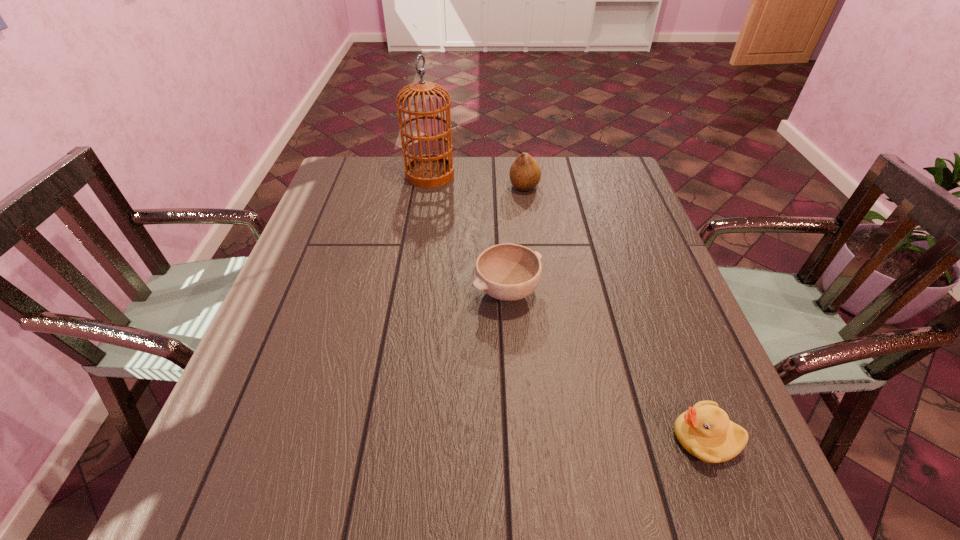
Find the location of `vacant space at the far right corner`. vacant space at the far right corner is located at coordinates (614, 188).

Find the location of `free spot between the third shortest object and the duckling`. free spot between the third shortest object and the duckling is located at coordinates (615, 312).

The height and width of the screenshot is (540, 960). What are the coordinates of `free space that is in between the second tallest object and the tallest object` in the screenshot? It's located at (477, 181).

The height and width of the screenshot is (540, 960). What are the coordinates of `unoccupied position between the leftmost object and the duckling` in the screenshot? It's located at (567, 306).

In order to click on empty location between the nearest object and the pear in this screenshot , I will do `click(615, 312)`.

Where is `free space between the second nearest object and the nearest object`? This screenshot has height=540, width=960. free space between the second nearest object and the nearest object is located at coordinates (607, 364).

The width and height of the screenshot is (960, 540). In order to click on free spot between the birdcage and the second tallest object in this screenshot , I will do `click(477, 181)`.

This screenshot has height=540, width=960. Find the location of `vacant area that lies between the bowl and the pear`. vacant area that lies between the bowl and the pear is located at coordinates (516, 239).

Image resolution: width=960 pixels, height=540 pixels. I want to click on vacant point located between the nearest object and the second nearest object, so click(x=607, y=364).

The image size is (960, 540). What are the coordinates of `free space between the nearest object and the third farthest object` in the screenshot? It's located at (607, 364).